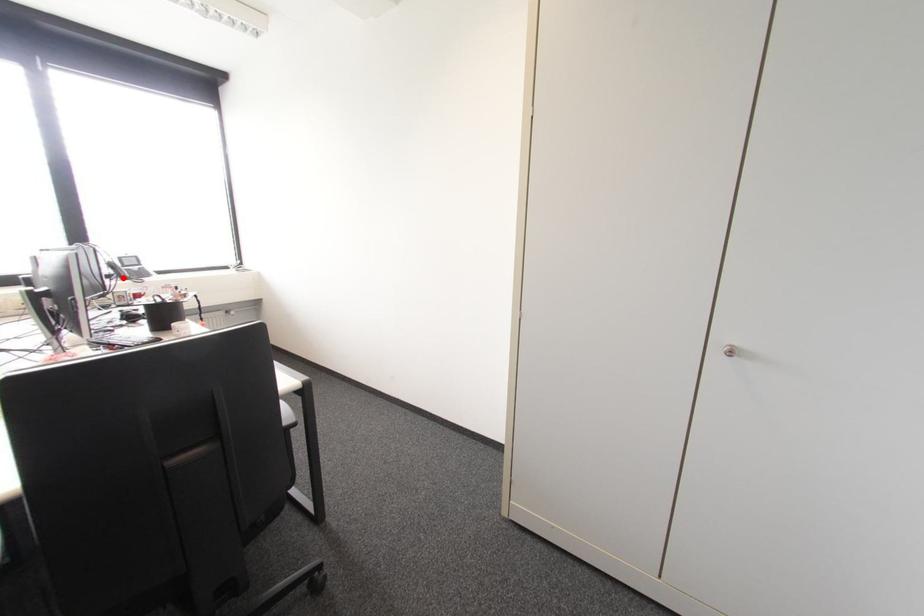
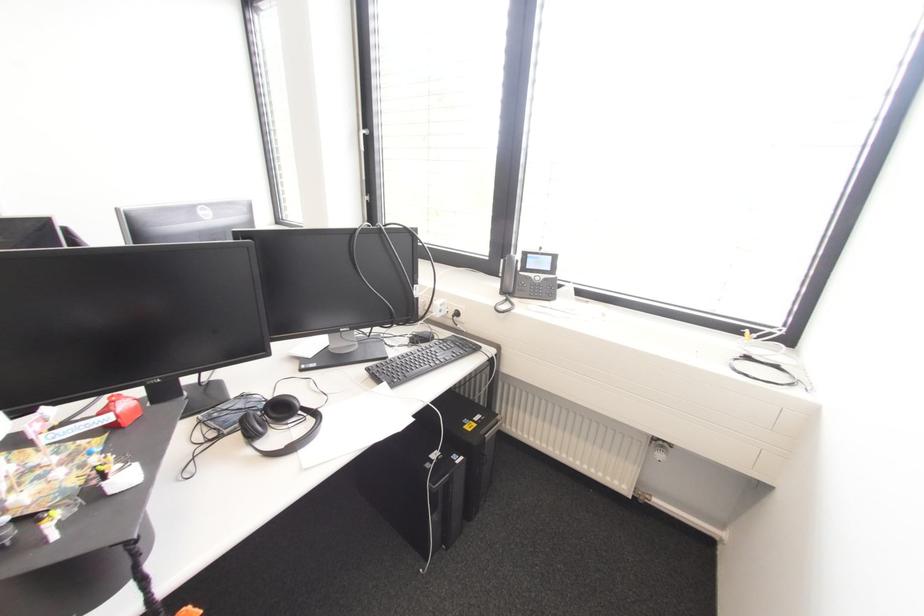
The point at the highlighted location is marked in the first image. Where is the corresponding point in the second image?

(503, 292)